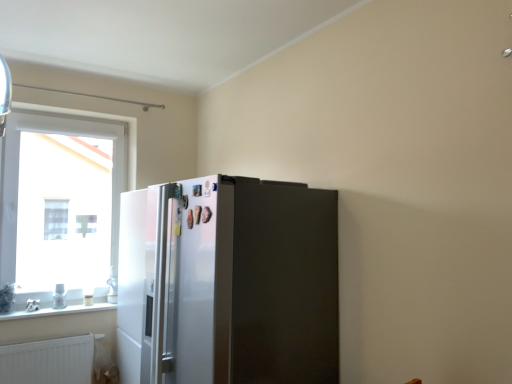
Question: Is satin silver refrigerator at center located within white glossy window sill at lower left?

Choices:
 (A) no
 (B) yes

Answer: (A)

Question: Is white glossy window sill at lower left to the right of satin silver refrigerator at center from the viewer's perspective?

Choices:
 (A) no
 (B) yes

Answer: (A)

Question: Does white glossy window sill at lower left have a lesser width compared to satin silver refrigerator at center?

Choices:
 (A) no
 (B) yes

Answer: (B)

Question: Is white glossy window sill at lower left aimed at satin silver refrigerator at center?

Choices:
 (A) yes
 (B) no

Answer: (B)

Question: Is white glossy window sill at lower left turned away from satin silver refrigerator at center?

Choices:
 (A) yes
 (B) no

Answer: (B)

Question: In the image, is white glossy window sill at lower left positioned in front of or behind clear glass window at left?

Choices:
 (A) front
 (B) behind

Answer: (A)

Question: In the image, is white glossy window sill at lower left on the left side or the right side of clear glass window at left?

Choices:
 (A) right
 (B) left

Answer: (A)

Question: Is point (70, 306) closer or farther from the camera than point (31, 243)?

Choices:
 (A) farther
 (B) closer

Answer: (B)

Question: Looking at their shapes, would you say white glossy window sill at lower left is wider or thinner than clear glass window at left?

Choices:
 (A) wide
 (B) thin

Answer: (A)

Question: Does point (50, 365) appear closer or farther from the camera than point (32, 254)?

Choices:
 (A) closer
 (B) farther

Answer: (A)

Question: From the image's perspective, is white matte radiator at lower left positioned above or below clear glass window at left?

Choices:
 (A) above
 (B) below

Answer: (B)

Question: Considering their positions, is white matte radiator at lower left located in front of or behind clear glass window at left?

Choices:
 (A) front
 (B) behind

Answer: (A)

Question: Considering the positions of white matte radiator at lower left and clear glass window at left in the image, is white matte radiator at lower left wider or thinner than clear glass window at left?

Choices:
 (A) wide
 (B) thin

Answer: (B)

Question: In terms of width, does satin silver refrigerator at center look wider or thinner when compared to clear glass window at left?

Choices:
 (A) thin
 (B) wide

Answer: (B)

Question: Considering the positions of satin silver refrigerator at center and clear glass window at left in the image, is satin silver refrigerator at center taller or shorter than clear glass window at left?

Choices:
 (A) short
 (B) tall

Answer: (A)